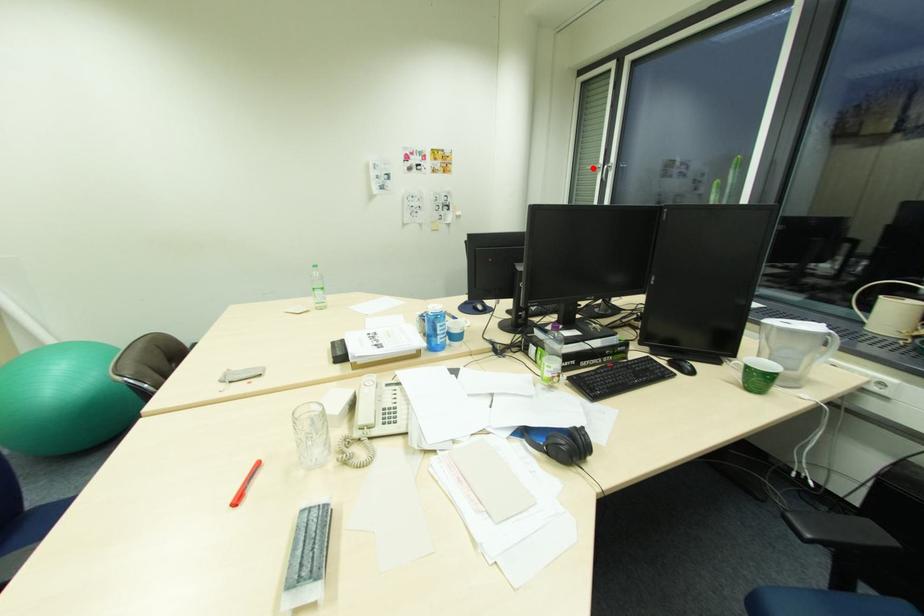
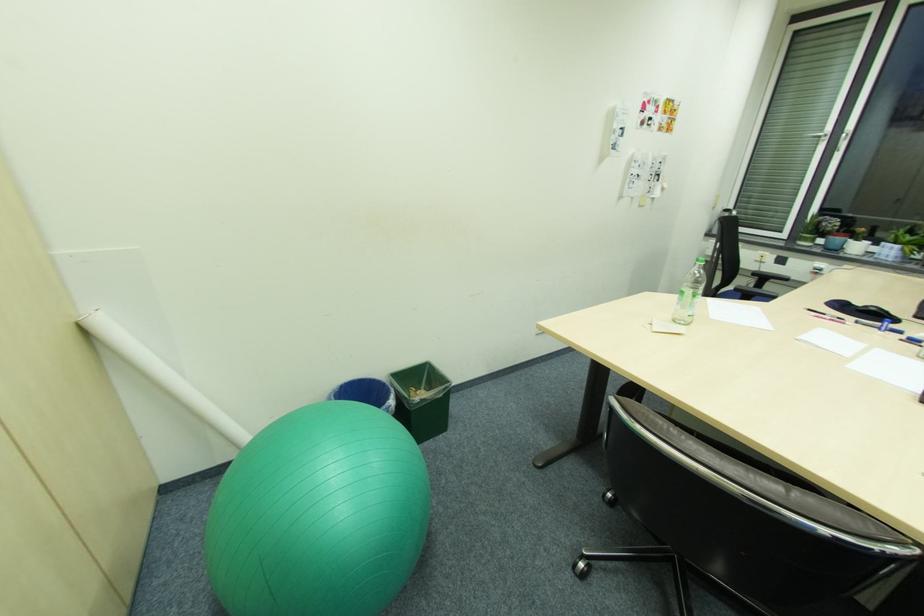
Question: I am providing you with two images of the same scene from different viewpoints. Given a red point in image1, look at the same physical point in image2. Is it:

Choices:
 (A) Closer to the viewpoint
 (B) Farther from the viewpoint

Answer: (B)